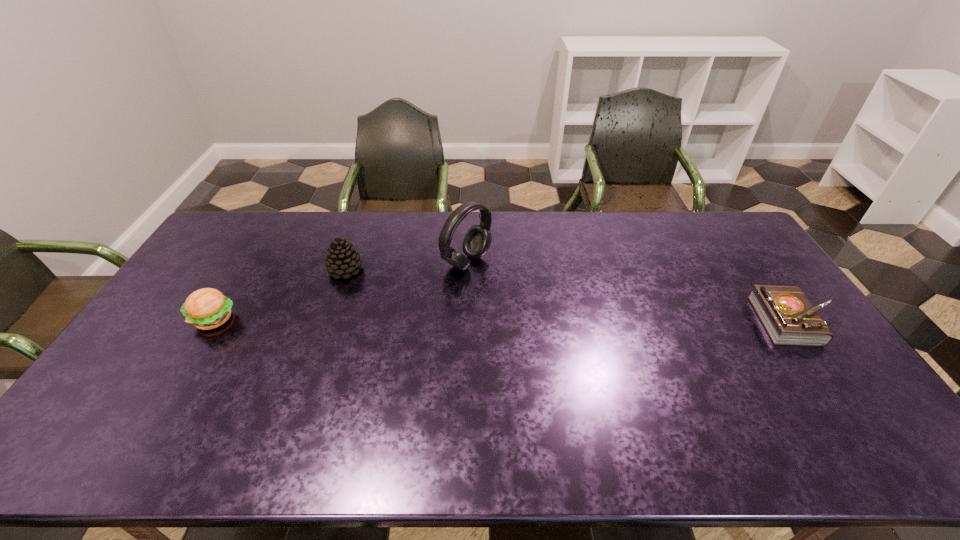
Locate an element on the screen. vacant position located 0.170m at the narrow end of the second tallest object is located at coordinates (396, 297).

Image resolution: width=960 pixels, height=540 pixels. Find the location of `free space located at the narrow end of the second tallest object`. free space located at the narrow end of the second tallest object is located at coordinates (406, 302).

Locate an element on the screen. This screenshot has width=960, height=540. vacant area located at the narrow end of the second tallest object is located at coordinates (406, 302).

Find the location of `free space located on the earcups of the headset`. free space located on the earcups of the headset is located at coordinates (572, 320).

Where is `vacant area situated 0.080m on the earcups of the headset`? vacant area situated 0.080m on the earcups of the headset is located at coordinates (505, 284).

Identify the location of vacant space located on the earcups of the headset. This screenshot has width=960, height=540. (498, 280).

Locate an element on the screen. The width and height of the screenshot is (960, 540). object present at the far edge is located at coordinates (477, 240).

Identify the location of object at the left edge. Image resolution: width=960 pixels, height=540 pixels. (207, 308).

Locate an element on the screen. object present at the right edge is located at coordinates (789, 318).

This screenshot has height=540, width=960. I want to click on vacant position at the far edge of the desktop, so click(x=439, y=230).